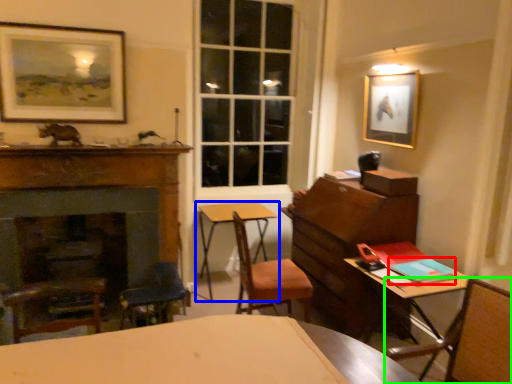
Question: Considering the real-world distances, which object is farthest from book (highlighted by a red box)? table (highlighted by a blue box) or chair (highlighted by a green box)?

Choices:
 (A) table
 (B) chair

Answer: (A)